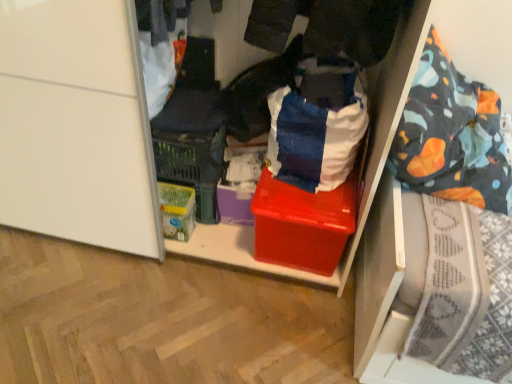
Question: Does shiny plastic box at center have a smaller size compared to white cotton shirt at upper left, arranged as the second clothing when viewed from the right?

Choices:
 (A) no
 (B) yes

Answer: (A)

Question: Can you confirm if shiny plastic box at center is thinner than white cotton shirt at upper left, the first clothing positioned from the left?

Choices:
 (A) yes
 (B) no

Answer: (B)

Question: Is shiny plastic box at center next to white cotton shirt at upper left, the first clothing positioned from the left?

Choices:
 (A) yes
 (B) no

Answer: (B)

Question: From the image's perspective, is shiny plastic box at center on white cotton shirt at upper left, arranged as the second clothing when viewed from the right?

Choices:
 (A) yes
 (B) no

Answer: (B)

Question: From a real-world perspective, is shiny plastic box at center over white cotton shirt at upper left, the first clothing positioned from the left?

Choices:
 (A) no
 (B) yes

Answer: (A)

Question: In terms of width, does white cotton shirt at upper left, the first clothing positioned from the left, look wider or thinner when compared to shiny plastic box at center?

Choices:
 (A) wide
 (B) thin

Answer: (B)

Question: From a real-world perspective, relative to shiny plastic box at center, is white cotton shirt at upper left, arranged as the second clothing when viewed from the right, vertically above or below?

Choices:
 (A) below
 (B) above

Answer: (B)

Question: In the image, is white cotton shirt at upper left, arranged as the second clothing when viewed from the right, positioned in front of or behind shiny plastic box at center?

Choices:
 (A) front
 (B) behind

Answer: (A)

Question: From the image's perspective, is white cotton shirt at upper left, the first clothing positioned from the left, above or below shiny plastic box at center?

Choices:
 (A) below
 (B) above

Answer: (B)

Question: Visually, is shiny plastic box at center positioned to the left or to the right of blue cotton shirt at center, positioned as the 2th clothing in left-to-right order?

Choices:
 (A) left
 (B) right

Answer: (B)

Question: Relative to blue cotton shirt at center, which appears as the first clothing when viewed from the right, is shiny plastic box at center in front or behind?

Choices:
 (A) front
 (B) behind

Answer: (B)

Question: From a real-world perspective, relative to blue cotton shirt at center, which appears as the first clothing when viewed from the right, is shiny plastic box at center vertically above or below?

Choices:
 (A) below
 (B) above

Answer: (A)

Question: In terms of width, does shiny plastic box at center look wider or thinner when compared to blue cotton shirt at center, positioned as the 2th clothing in left-to-right order?

Choices:
 (A) thin
 (B) wide

Answer: (B)

Question: Is point (154, 99) positioned closer to the camera than point (270, 89)?

Choices:
 (A) farther
 (B) closer

Answer: (A)

Question: Is white cotton shirt at upper left, arranged as the second clothing when viewed from the right, bigger or smaller than blue cotton shirt at center, which appears as the first clothing when viewed from the right?

Choices:
 (A) small
 (B) big

Answer: (A)